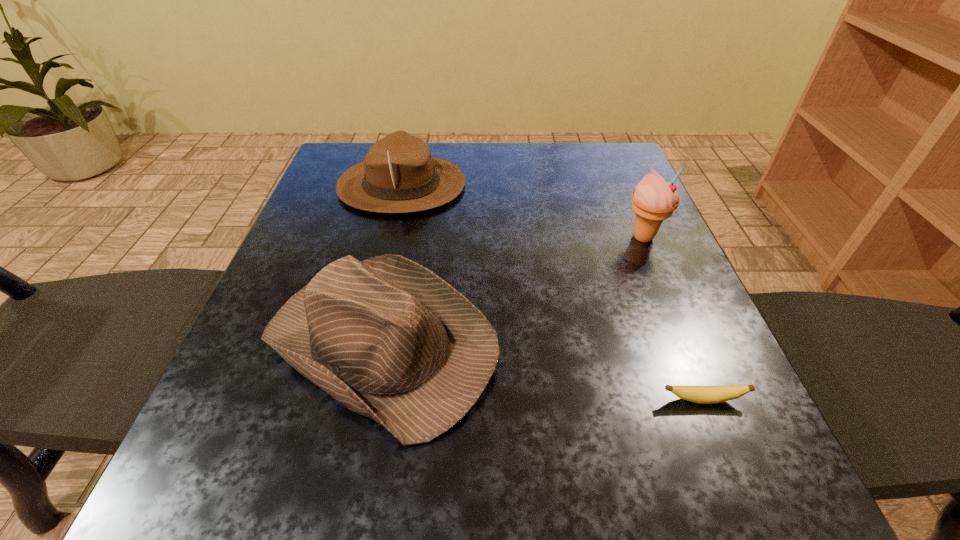
I want to click on icecream, so click(x=654, y=200).

The image size is (960, 540). Identify the location of the farther fedora. (399, 175).

Identify the location of the nearer fedora. (389, 339).

Identify the location of banana. (698, 394).

The width and height of the screenshot is (960, 540). I want to click on blank space located on the left of the icecream, so click(548, 237).

This screenshot has height=540, width=960. Identify the location of free space located on the feather side of the farther fedora. 524,185.

The image size is (960, 540). I want to click on vacant space located 0.180m on the right of the nearer fedora, so click(612, 343).

You are a GUI agent. You are given a task and a screenshot of the screen. Output one action in this format:
    pyautogui.click(x=<x>, y=<y>)
    Task: Click on the free spot located 0.120m on the front of the shortest object
    Image resolution: width=960 pixels, height=540 pixels.
    Given the screenshot: What is the action you would take?
    pyautogui.click(x=741, y=495)

The width and height of the screenshot is (960, 540). I want to click on object that is at the far edge, so click(399, 175).

Where is `object at the near edge`? The width and height of the screenshot is (960, 540). object at the near edge is located at coordinates [x=389, y=339].